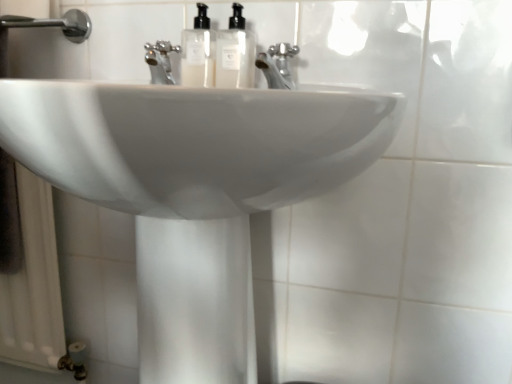
Question: Is point (144, 99) positioned closer to the camera than point (245, 52)?

Choices:
 (A) farther
 (B) closer

Answer: (B)

Question: Visually, is white glossy sink at center positioned to the left or to the right of translucent plastic soap dispenser at center, the second soap dispenser viewed from the left?

Choices:
 (A) right
 (B) left

Answer: (B)

Question: Considering the real-world distances, which object is closest to the chrome metallic faucet at center?

Choices:
 (A) translucent plastic soap dispenser at center, which is the first soap dispenser in left-to-right order
 (B) white glossy sink at center
 (C) translucent plastic soap dispenser at center, placed as the 1th soap dispenser when sorted from right to left

Answer: (C)

Question: Estimate the real-world distances between objects in this image. Which object is closer to the translucent plastic soap dispenser at center, the second soap dispenser viewed from the left?

Choices:
 (A) chrome metallic faucet at center
 (B) translucent plastic soap dispenser at center, which is the first soap dispenser in left-to-right order
 (C) white glossy sink at center

Answer: (B)